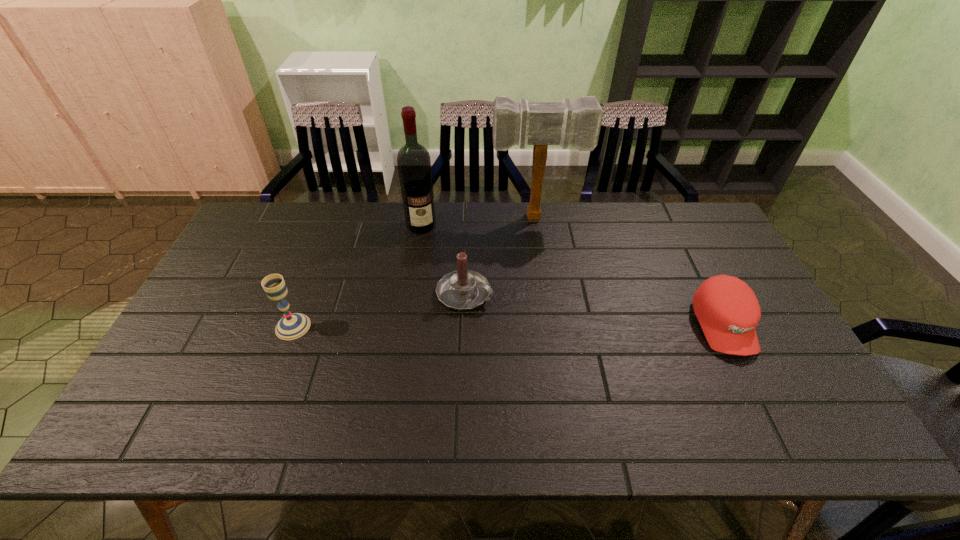
Where is `free spot between the second object from left to right and the shortest object`? free spot between the second object from left to right and the shortest object is located at coordinates (572, 275).

You are a GUI agent. You are given a task and a screenshot of the screen. Output one action in this format:
    pyautogui.click(x=<x>, y=<y>)
    Task: Click on the free space between the mallet and the third object from right to left
    This screenshot has height=540, width=960.
    Given the screenshot: What is the action you would take?
    pyautogui.click(x=500, y=256)

You are a GUI agent. You are given a task and a screenshot of the screen. Output one action in this format:
    pyautogui.click(x=<x>, y=<y>)
    Task: Click on the blank region between the candle and the rightmost object
    
    Given the screenshot: What is the action you would take?
    pyautogui.click(x=594, y=309)

Find the location of `vacant space in between the rightmost object and the chalice`. vacant space in between the rightmost object and the chalice is located at coordinates (508, 326).

Find the location of a particular element. This screenshot has width=960, height=540. vacant region between the cap and the third object from left to right is located at coordinates (594, 309).

The image size is (960, 540). In order to click on the second closest object to the alcohol in this screenshot , I will do `click(463, 289)`.

Point out which object is positioned as the fourth nearest to the rightmost object. Please provide its 2D coordinates. Your answer should be formatted as a tuple, i.e. [(x, y)], where the tuple contains the x and y coordinates of a point satisfying the conditions above.

[(293, 325)]

Find the location of a particular element. vacant position in the image that satisfies the following two spatial constraints: 1. on the back side of the third object from left to right; 2. on the right side of the leftmost object is located at coordinates (305, 294).